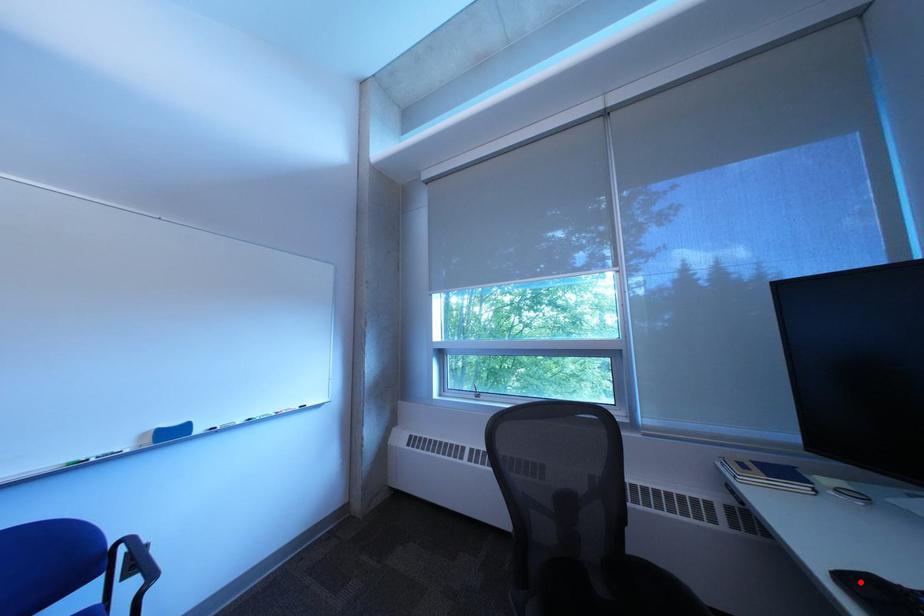
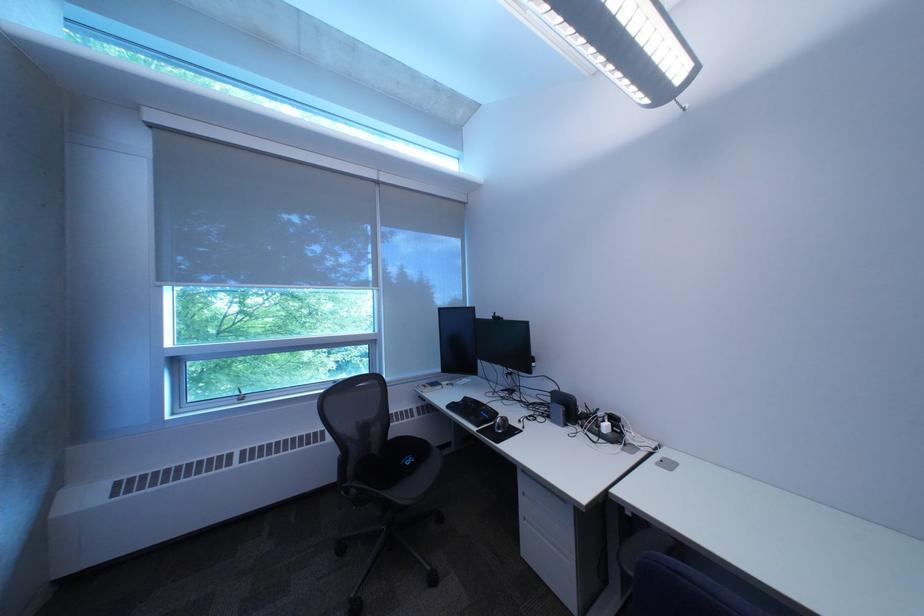
Where in the second image is the point corresponding to the highlighted location from the first image?

(464, 408)